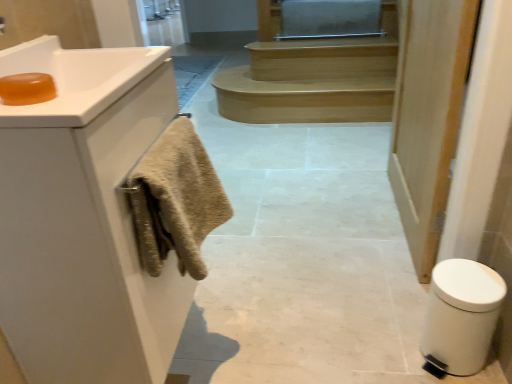
In order to face translucent amber soap at upper left, should I rotate leftwards or rightwards?

Rotate your view left by about 28.592°.

In order to click on white matte door at right in this screenshot , I will do `click(428, 116)`.

What is the approximate width of white matte door at right?

It is 3.61 inches.

The height and width of the screenshot is (384, 512). What do you see at coordinates (315, 64) in the screenshot?
I see `light brown wood stairs at center` at bounding box center [315, 64].

At what (x,y) coordinates should I click in order to perform the action: click on light brown wood stairs at center. Please return your answer as a coordinate pair (x, y). The height and width of the screenshot is (384, 512). Looking at the image, I should click on pos(315,64).

Find the location of a particular element. white plastic bidet at lower right is located at coordinates [x=461, y=316].

Describe the element at coordinates (84, 218) in the screenshot. This screenshot has height=384, width=512. I see `white matte cabinet at left` at that location.

Identify the location of white matte cabinet at left. (84, 218).

This screenshot has height=384, width=512. What are the coordinates of `translucent amber soap at upper left` in the screenshot? It's located at (27, 89).

Are white matte cabinet at left and beige textured towel at left far apart?

No, white matte cabinet at left is not far from beige textured towel at left.

Looking at their sizes, would you say white matte cabinet at left is wider or thinner than beige textured towel at left?

Clearly, white matte cabinet at left has more width compared to beige textured towel at left.

Image resolution: width=512 pixels, height=384 pixels. What are the coordinates of `bath towel behind the white matte cabinet at left` in the screenshot? It's located at (176, 200).

Does translucent amber soap at upper left have a greater width compared to white matte cabinet at left?

No.

How distant is translucent amber soap at upper left from white matte cabinet at left?

11.47 inches.

At what (x,y) coordinates should I click in order to perform the action: click on bathroom cabinet below the translucent amber soap at upper left (from a real-world perspective). Please return your answer as a coordinate pair (x, y). Looking at the image, I should click on (84, 218).

Considering the relative sizes of white plastic bidet at lower right and light brown wood stairs at center in the image provided, is white plastic bidet at lower right taller than light brown wood stairs at center?

Yes, white plastic bidet at lower right is taller than light brown wood stairs at center.

Is light brown wood stairs at center surrounded by white plastic bidet at lower right?

No.

Does white plastic bidet at lower right have a lesser width compared to light brown wood stairs at center?

Correct, the width of white plastic bidet at lower right is less than that of light brown wood stairs at center.

In the image, is white plastic bidet at lower right positioned in front of or behind light brown wood stairs at center?

white plastic bidet at lower right is positioned closer to the viewer than light brown wood stairs at center.

Which is more to the right, beige textured towel at left or white matte cabinet at left?

From the viewer's perspective, beige textured towel at left appears more on the right side.

Considering the positions of point (183, 228) and point (15, 302), is point (183, 228) closer or farther from the camera than point (15, 302)?

Point (183, 228) is closer to the camera than point (15, 302).

Is beige textured towel at left oriented towards white matte cabinet at left?

No, beige textured towel at left is not facing towards white matte cabinet at left.

Identify the location of bath towel behind the white matte cabinet at left. The height and width of the screenshot is (384, 512). (176, 200).

How many degrees apart are the facing directions of white plastic bidet at lower right and white matte door at right?

There is a 48.8-degree angle between the facing directions of white plastic bidet at lower right and white matte door at right.

From the image's perspective, is white plastic bidet at lower right positioned above or below white matte door at right?

Based on their image positions, white plastic bidet at lower right is located beneath white matte door at right.

Considering the relative sizes of white plastic bidet at lower right and white matte door at right in the image provided, is white plastic bidet at lower right smaller than white matte door at right?

Yes, white plastic bidet at lower right is smaller than white matte door at right.

Between white plastic bidet at lower right and white matte door at right, which one is positioned in front?

white plastic bidet at lower right is more forward.

What's the angular difference between translucent amber soap at upper left and beige textured towel at left's facing directions?

0.107 degrees.

Is translucent amber soap at upper left far from beige textured towel at left?

That's not correct — translucent amber soap at upper left is a little close to beige textured towel at left.

Considering the relative sizes of translucent amber soap at upper left and beige textured towel at left in the image provided, is translucent amber soap at upper left thinner than beige textured towel at left?

Correct, the width of translucent amber soap at upper left is less than that of beige textured towel at left.

Between translucent amber soap at upper left and beige textured towel at left, which one has smaller size?

Smaller between the two is translucent amber soap at upper left.

In terms of height, does white matte door at right look taller or shorter compared to white matte cabinet at left?

white matte door at right is taller than white matte cabinet at left.

Is white matte door at right with white matte cabinet at left?

No.

From the picture: Considering the relative sizes of white matte door at right and white matte cabinet at left in the image provided, is white matte door at right thinner than white matte cabinet at left?

Yes, white matte door at right is thinner than white matte cabinet at left.

Is white matte cabinet at left at the back of white matte door at right?

No, white matte cabinet at left is not at the back of white matte door at right.

Identify the location of bath towel on the right of white matte cabinet at left. This screenshot has height=384, width=512. (176, 200).

Where is `soap that appears on the left of white matte cabinet at left`? Image resolution: width=512 pixels, height=384 pixels. soap that appears on the left of white matte cabinet at left is located at coordinates (27, 89).

Estimate the real-world distances between objects in this image. Which object is further from white plastic bidet at lower right, white matte cabinet at left or translucent amber soap at upper left?

translucent amber soap at upper left lies further to white plastic bidet at lower right than the other object.

Based on their spatial positions, is translucent amber soap at upper left or beige textured towel at left further from light brown wood stairs at center?

translucent amber soap at upper left is further to light brown wood stairs at center.

From the image, which object appears to be farther from light brown wood stairs at center, beige textured towel at left or translucent amber soap at upper left?

translucent amber soap at upper left is further to light brown wood stairs at center.

From the image, which object appears to be nearer to translucent amber soap at upper left, white matte cabinet at left or beige textured towel at left?

beige textured towel at left lies closer to translucent amber soap at upper left than the other object.

Considering their positions, is light brown wood stairs at center positioned further to white matte door at right than white matte cabinet at left?

Among the two, light brown wood stairs at center is located further to white matte door at right.

Looking at the image, which one is located closer to white matte door at right, white plastic bidet at lower right or white matte cabinet at left?

white plastic bidet at lower right.

Which object lies further to the anchor point white plastic bidet at lower right, beige textured towel at left or translucent amber soap at upper left?

translucent amber soap at upper left lies further to white plastic bidet at lower right than the other object.

Estimate the real-world distances between objects in this image. Which object is further from beige textured towel at left, white matte door at right or light brown wood stairs at center?

The object further to beige textured towel at left is light brown wood stairs at center.

This screenshot has height=384, width=512. In order to click on bath towel located between white matte cabinet at left and light brown wood stairs at center in the depth direction in this screenshot , I will do `click(176, 200)`.

Where is `door between translucent amber soap at upper left and light brown wood stairs at center from front to back`? This screenshot has width=512, height=384. door between translucent amber soap at upper left and light brown wood stairs at center from front to back is located at coordinates (428, 116).

Where is `bath towel between translucent amber soap at upper left and white plastic bidet at lower right from left to right`? This screenshot has height=384, width=512. bath towel between translucent amber soap at upper left and white plastic bidet at lower right from left to right is located at coordinates (176, 200).

I want to click on bathroom cabinet between translucent amber soap at upper left and white matte door at right in the horizontal direction, so click(x=84, y=218).